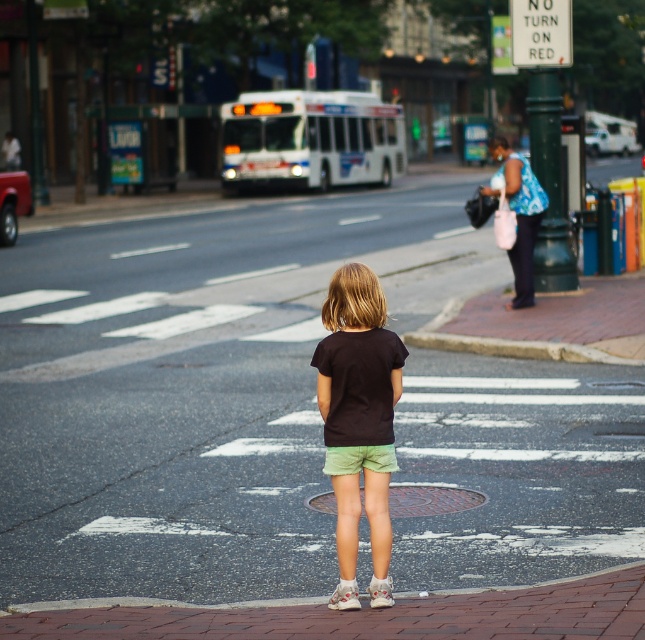
Is smooth asphalt road at center below matte black shirt at center?

Actually, smooth asphalt road at center is above matte black shirt at center.

Is smooth asphalt road at center to the left of matte black shirt at center from the viewer's perspective?

Correct, you'll find smooth asphalt road at center to the left of matte black shirt at center.

At what (x,y) coordinates should I click in order to perform the action: click on smooth asphalt road at center. Please return your answer as a coordinate pair (x, y). The image size is (645, 640). Looking at the image, I should click on (195, 388).